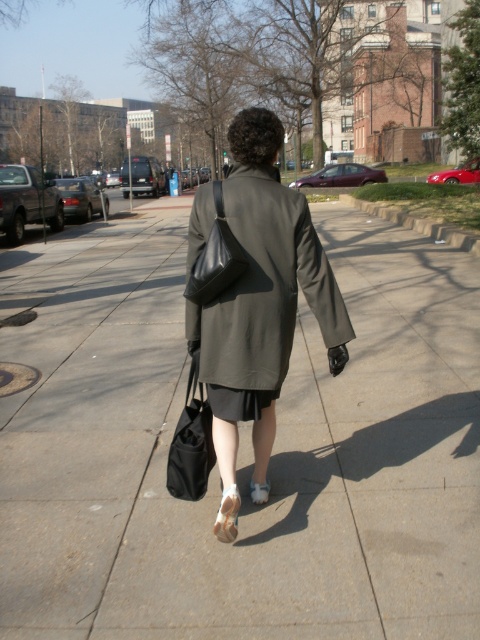
Question: Can you confirm if black leather bag at center is thinner than white leather sandal at lower center?

Choices:
 (A) yes
 (B) no

Answer: (B)

Question: Can you confirm if olive green fabric coat at center is bigger than white leather sandal at lower center?

Choices:
 (A) no
 (B) yes

Answer: (B)

Question: Is black fabric bag at lower center wider than white leather sandal at lower center?

Choices:
 (A) no
 (B) yes

Answer: (B)

Question: Which of the following is the closest to the observer?

Choices:
 (A) black leather bag at center
 (B) black fabric bag at lower center

Answer: (A)

Question: Which point is farther to the camera?

Choices:
 (A) (189, 419)
 (B) (204, 355)

Answer: (A)

Question: Which of the following is the farthest from the observer?

Choices:
 (A) pyautogui.click(x=220, y=273)
 (B) pyautogui.click(x=288, y=292)

Answer: (B)